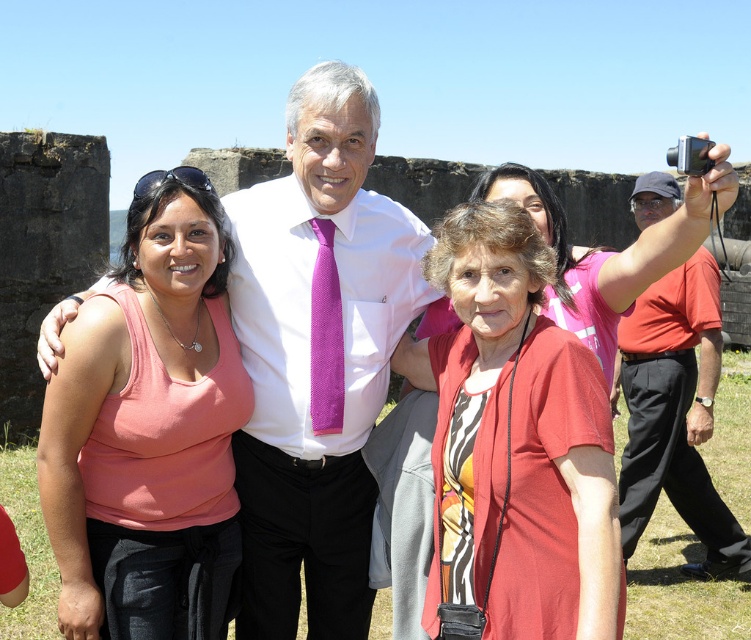
Question: Estimate the real-world distances between objects in this image. Which object is closer to the matte red shirt at center?

Choices:
 (A) pink textured tie at center
 (B) pink fabric tank top at left
 (C) orange cotton shirt at right

Answer: (A)

Question: Does pink fabric tank top at left appear on the right side of matte red shirt at center?

Choices:
 (A) yes
 (B) no

Answer: (B)

Question: Estimate the real-world distances between objects in this image. Which object is closer to the pink fabric tank top at left?

Choices:
 (A) pink textured tie at center
 (B) matte red shirt at center

Answer: (A)

Question: Is pink fabric tank top at left positioned in front of pink textured tie at center?

Choices:
 (A) no
 (B) yes

Answer: (B)

Question: Which point is closer to the camera?

Choices:
 (A) (691, 449)
 (B) (327, 419)
 (C) (53, 412)
 (D) (475, 577)

Answer: (D)

Question: Is matte red shirt at center positioned in front of pink textured tie at center?

Choices:
 (A) no
 (B) yes

Answer: (B)